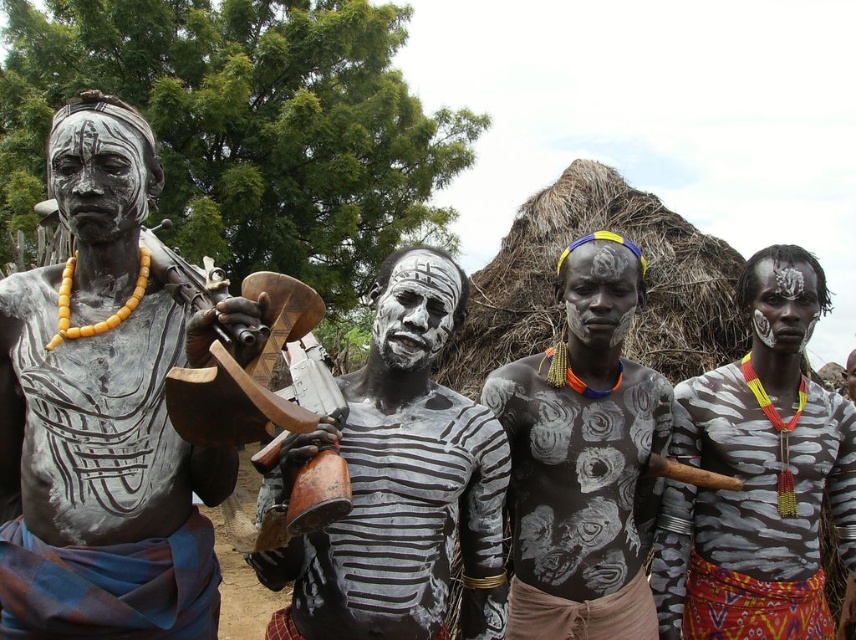
Which is more to the right, gray matte face at center or white matte face at center?

white matte face at center

Is point (634, 285) positioned after point (806, 340)?

No.

You are a GUI agent. You are given a task and a screenshot of the screen. Output one action in this format:
    pyautogui.click(x=<x>, y=<y>)
    Task: Click on the gray matte face at center
    
    Given the screenshot: What is the action you would take?
    pyautogui.click(x=599, y=292)

Between matte black statue at left and white matte face at center, which one is positioned lower?

matte black statue at left is lower down.

Does matte black statue at left appear on the right side of white matte face at center?

No, matte black statue at left is not to the right of white matte face at center.

The image size is (856, 640). In order to click on matte black statue at left in this screenshot , I will do `click(103, 412)`.

Is black textured body paint at center closer to the viewer compared to gray matte face at center?

Yes, it is.

Find the location of a particular element. Image resolution: width=856 pixels, height=640 pixels. black textured body paint at center is located at coordinates (583, 458).

Locate an element on the screen. black textured body paint at center is located at coordinates (583, 458).